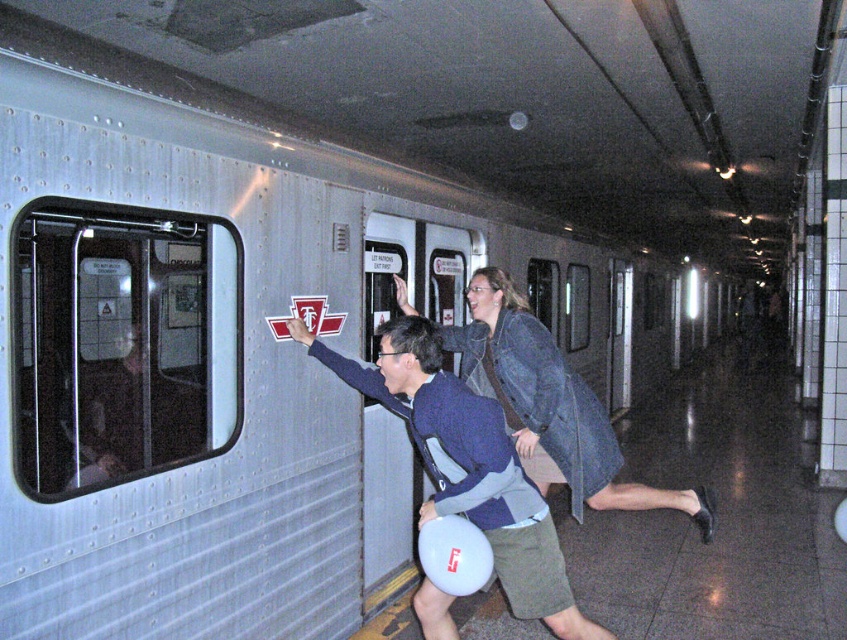
Question: Which of the following is the closest to the observer?

Choices:
 (A) denim jacket at center
 (B) blue fabric shirt at center

Answer: (B)

Question: Can you confirm if blue fabric shirt at center is positioned above denim jacket at center?

Choices:
 (A) no
 (B) yes

Answer: (A)

Question: Can you confirm if blue fabric shirt at center is smaller than denim jacket at center?

Choices:
 (A) yes
 (B) no

Answer: (A)

Question: Which point is closer to the camera?

Choices:
 (A) denim jacket at center
 (B) blue fabric shirt at center

Answer: (B)

Question: From the image, what is the correct spatial relationship of blue fabric shirt at center in relation to denim jacket at center?

Choices:
 (A) below
 (B) above

Answer: (A)

Question: Among these points, which one is farthest from the camera?

Choices:
 (A) (552, 616)
 (B) (519, 444)

Answer: (B)